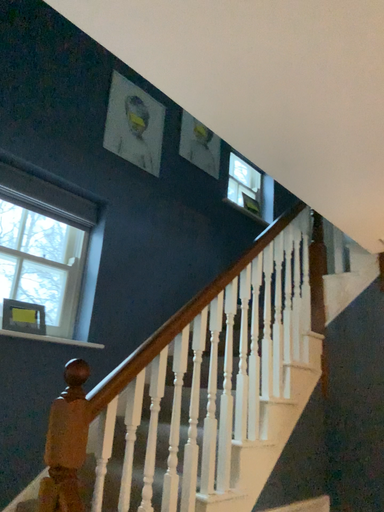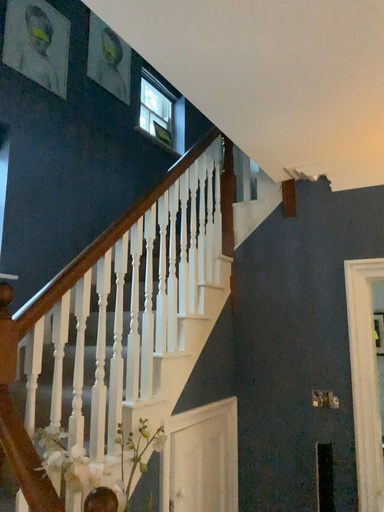
Question: Which way did the camera rotate in the video?

Choices:
 (A) rotated downward
 (B) rotated upward

Answer: (A)